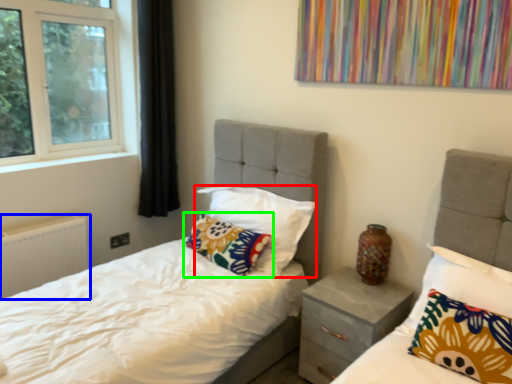
Question: Based on their relative distances, which object is farther from pillow (highlighted by a red box)? Choose from radiator (highlighted by a blue box) and pillow (highlighted by a green box).

Choices:
 (A) radiator
 (B) pillow

Answer: (A)